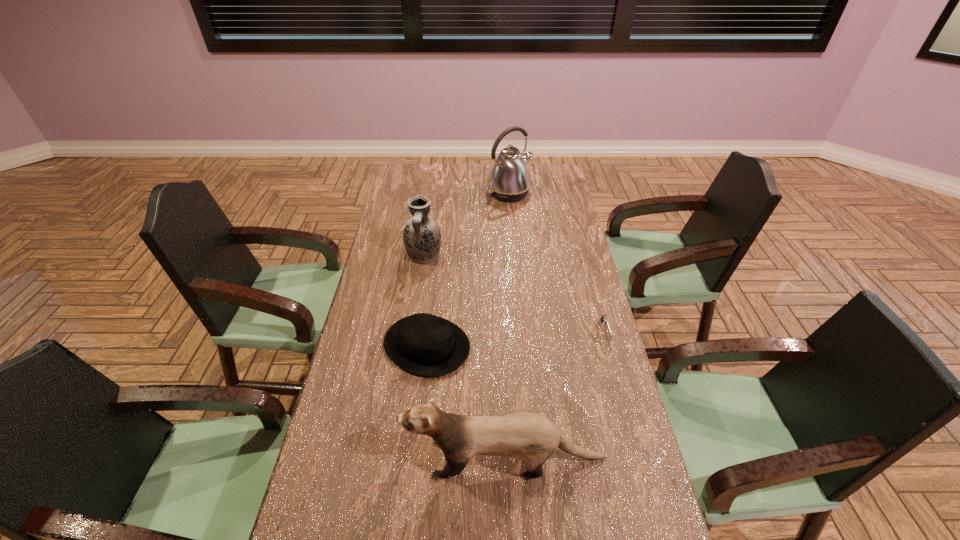
You are a GUI agent. You are given a task and a screenshot of the screen. Output one action in this format:
    pyautogui.click(x=<x>, y=<y>)
    Task: Click on the vacant point located between the shortest object and the ferret
    This screenshot has width=960, height=540.
    Given the screenshot: What is the action you would take?
    pyautogui.click(x=555, y=396)

Select which object appears as the second closest to the shortest object. Please provide its 2D coordinates. Your answer should be formatted as a tuple, i.e. [(x, y)], where the tuple contains the x and y coordinates of a point satisfying the conditions above.

[(423, 344)]

This screenshot has width=960, height=540. What are the coordinates of `object that is the nearest to the nearest object` in the screenshot? It's located at (423, 344).

At what (x,y) coordinates should I click in order to perform the action: click on free region that satisfies the following two spatial constraints: 1. on the front-facing side of the shortest object; 2. on the face of the nearest object. Please return your answer as a coordinate pair (x, y). Image resolution: width=960 pixels, height=540 pixels. Looking at the image, I should click on (639, 458).